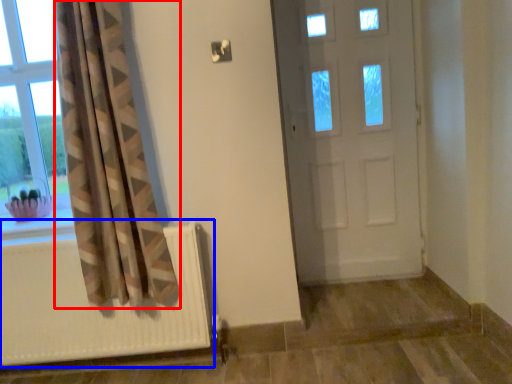
Question: Which point is further to the camera, curtain (highlighted by a red box) or radiator (highlighted by a blue box)?

Choices:
 (A) curtain
 (B) radiator

Answer: (B)